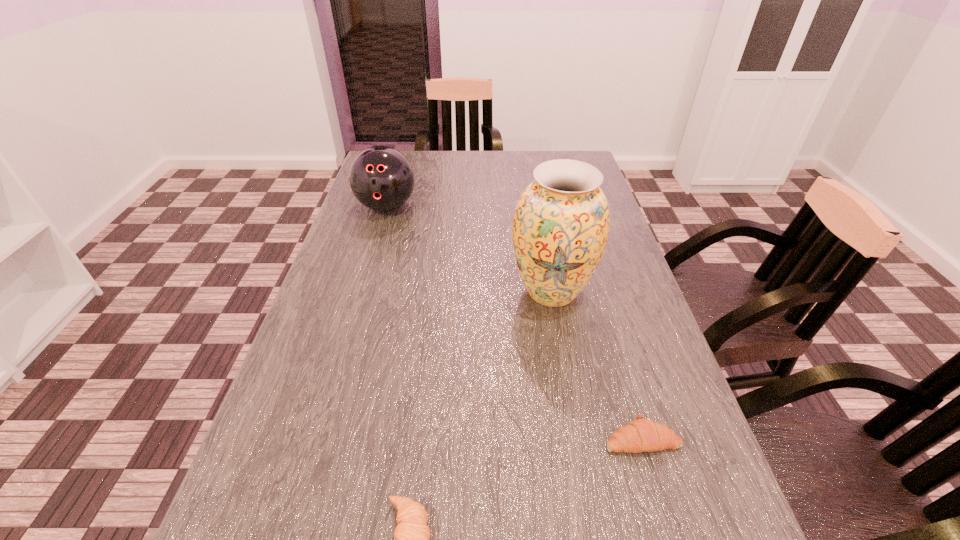
Where is `vacant space in between the second nearest object and the farthest object`? vacant space in between the second nearest object and the farthest object is located at coordinates (515, 322).

Locate which object ranks in proximity to the farthest object. Please provide its 2D coordinates. Your answer should be formatted as a tuple, i.e. [(x, y)], where the tuple contains the x and y coordinates of a point satisfying the conditions above.

[(560, 229)]

Identify the location of object that is the closest to the leftmost object. (560, 229).

This screenshot has width=960, height=540. Identify the location of free space that satisfies the following two spatial constraints: 1. on the surface of the bowling ball near the finger holes; 2. on the right side of the right crescent roll. (319, 438).

Find the location of a particular element. vacant region that satisfies the following two spatial constraints: 1. on the surface of the right crescent roll near the finger holes; 2. on the right side of the leftmost object is located at coordinates (319, 438).

The image size is (960, 540). I want to click on free location that satisfies the following two spatial constraints: 1. on the surface of the leftmost object near the finger holes; 2. on the left side of the tallest object, so click(362, 292).